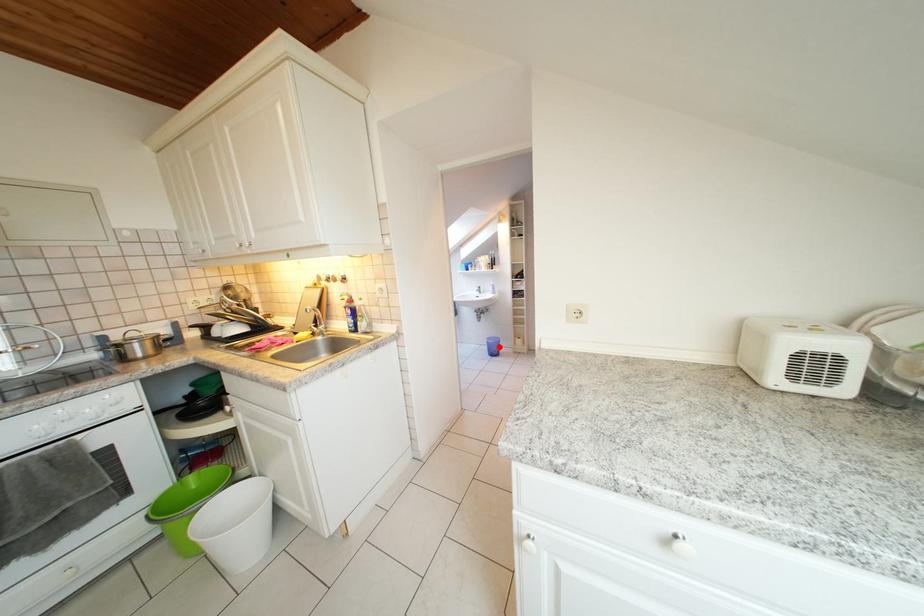
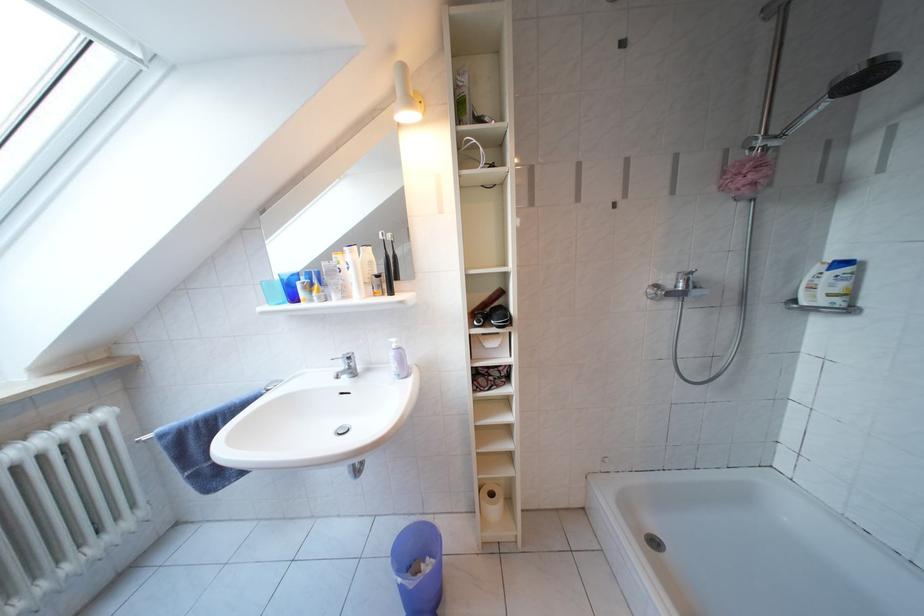
Question: I am providing you with two images of the same scene from different viewpoints. A red point is shown in image1. For the corresponding object point in image2, is it positioned nearer or farther from the camera?

Choices:
 (A) Nearer
 (B) Farther

Answer: (A)